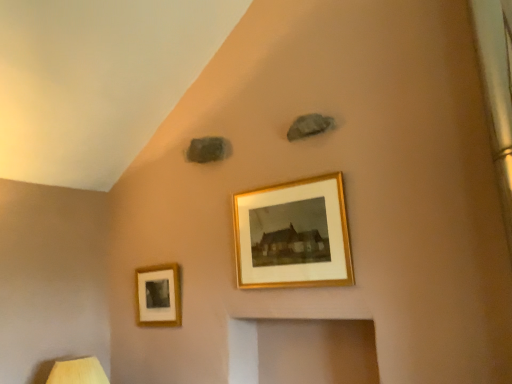
Question: Considering the relative sizes of wooden table lamp at lower left and gold-framed picture at center, the 1th picture frame positioned from the front, in the image provided, is wooden table lamp at lower left smaller than gold-framed picture at center, the 1th picture frame positioned from the front,?

Choices:
 (A) no
 (B) yes

Answer: (A)

Question: Considering the relative sizes of wooden table lamp at lower left and gold-framed picture at center, the 2th picture frame viewed from the left, in the image provided, is wooden table lamp at lower left taller than gold-framed picture at center, the 2th picture frame viewed from the left,?

Choices:
 (A) no
 (B) yes

Answer: (A)

Question: Is gold-framed picture at center, the 1th picture frame positioned from the front, a part of wooden table lamp at lower left?

Choices:
 (A) no
 (B) yes

Answer: (A)

Question: Is wooden table lamp at lower left turned away from gold-framed picture at center, which is the 1th picture frame in right-to-left order?

Choices:
 (A) no
 (B) yes

Answer: (A)

Question: Can you confirm if wooden table lamp at lower left is thinner than gold-framed picture at center, the 1th picture frame when ordered from top to bottom?

Choices:
 (A) yes
 (B) no

Answer: (B)

Question: Is gold-framed picture at center, the 1th picture frame when ordered from top to bottom, taller or shorter than wooden table lamp at lower left?

Choices:
 (A) short
 (B) tall

Answer: (B)

Question: Is gold-framed picture at center, the 1th picture frame positioned from the front, wider or thinner than wooden table lamp at lower left?

Choices:
 (A) thin
 (B) wide

Answer: (A)

Question: Would you say gold-framed picture at center, positioned as the 2th picture frame in bottom-to-top order, is inside or outside wooden table lamp at lower left?

Choices:
 (A) inside
 (B) outside

Answer: (B)

Question: From a real-world perspective, is gold-framed picture at center, the 2th picture frame positioned from the back, positioned above or below wooden table lamp at lower left?

Choices:
 (A) below
 (B) above

Answer: (B)

Question: Is point (53, 364) positioned closer to the camera than point (138, 322)?

Choices:
 (A) farther
 (B) closer

Answer: (B)

Question: Is wooden table lamp at lower left wider or thinner than matte gold picture frame at lower left, the first picture frame positioned from the back?

Choices:
 (A) wide
 (B) thin

Answer: (A)

Question: Looking at the image, does wooden table lamp at lower left seem bigger or smaller compared to matte gold picture frame at lower left, the second picture frame from the top?

Choices:
 (A) small
 (B) big

Answer: (B)

Question: Considering their positions, is wooden table lamp at lower left located in front of or behind matte gold picture frame at lower left, the 2th picture frame when ordered from front to back?

Choices:
 (A) behind
 (B) front

Answer: (B)

Question: Considering the positions of matte gold picture frame at lower left, which is the 1th picture frame in bottom-to-top order, and gold-framed picture at center, the 1th picture frame when ordered from top to bottom, in the image, is matte gold picture frame at lower left, which is the 1th picture frame in bottom-to-top order, taller or shorter than gold-framed picture at center, the 1th picture frame when ordered from top to bottom,?

Choices:
 (A) tall
 (B) short

Answer: (B)

Question: From a real-world perspective, is matte gold picture frame at lower left, which is the 1th picture frame in bottom-to-top order, positioned above or below gold-framed picture at center, the 1th picture frame when ordered from top to bottom?

Choices:
 (A) above
 (B) below

Answer: (B)